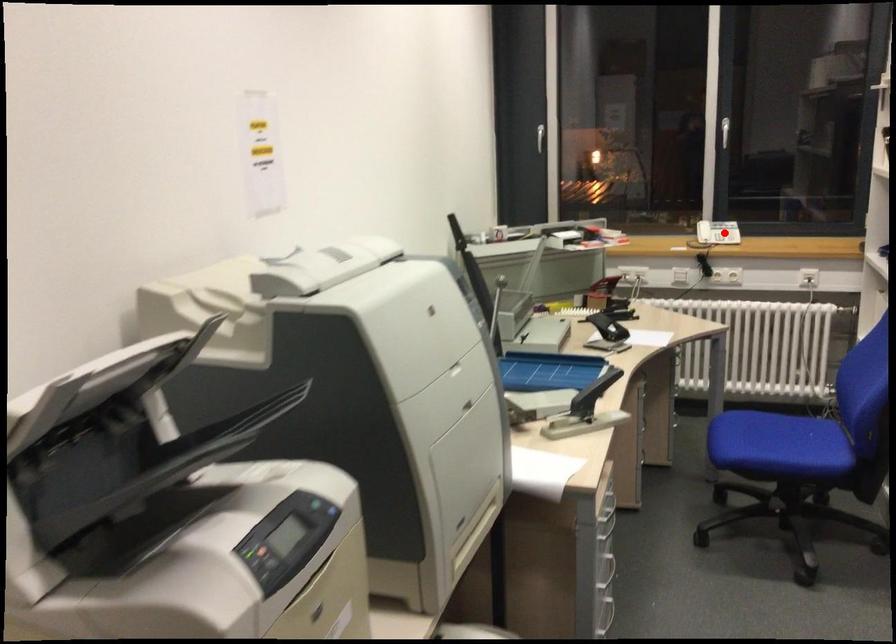
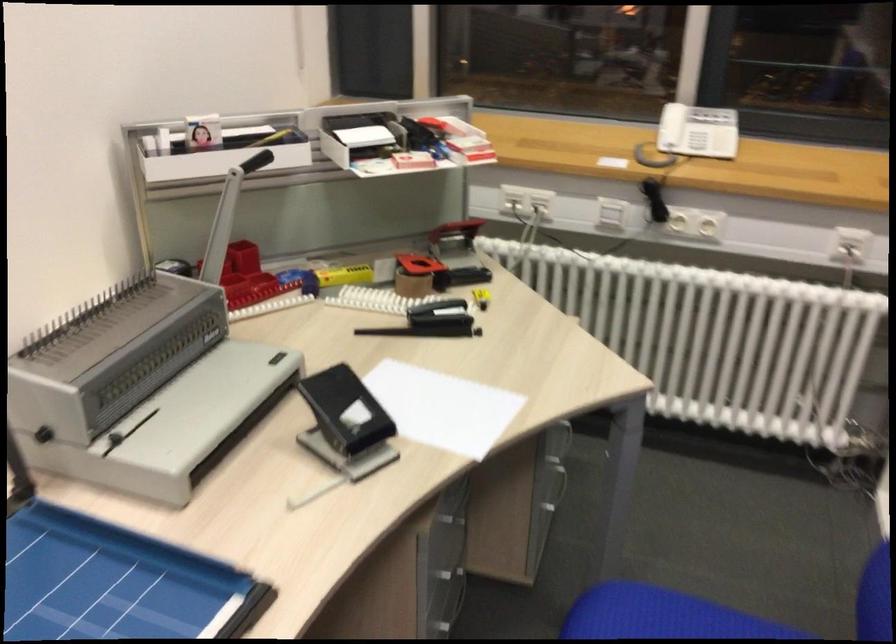
Locate, in the second image, the point that corresponds to the highlighted location in the first image.

(686, 144)